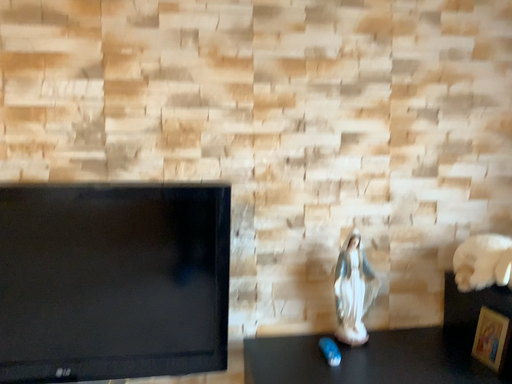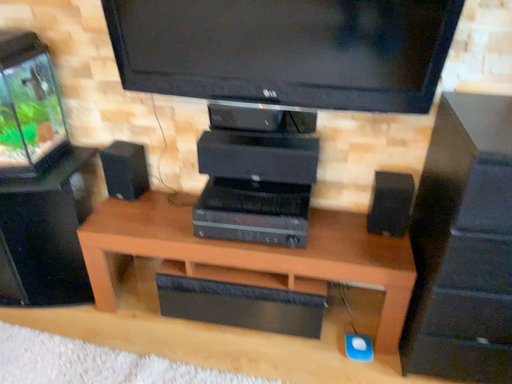
Question: Which way did the camera rotate in the video?

Choices:
 (A) rotated downward
 (B) rotated upward

Answer: (A)